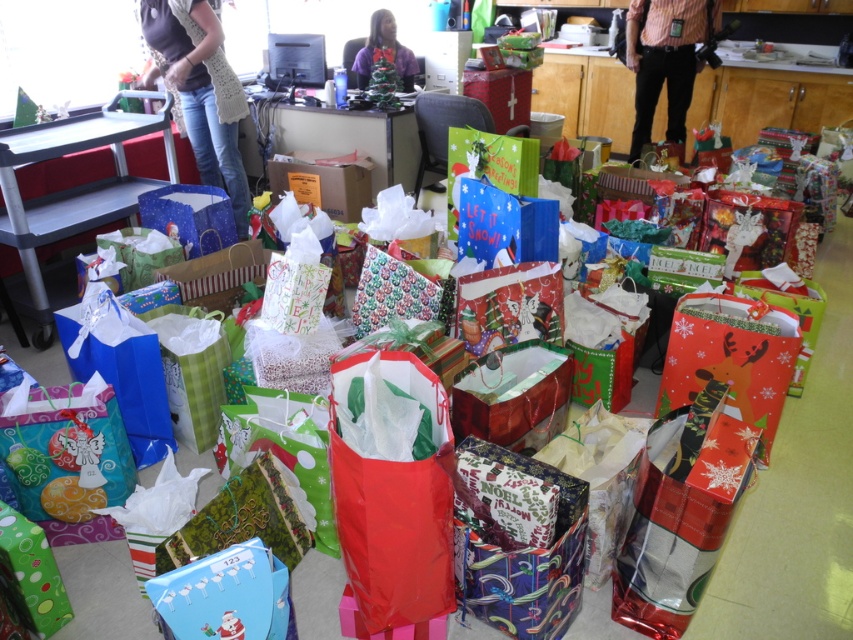
From the picture: You are at a Christmas party and see the denim jeans at left and the striped shirt at upper right. Which one is closer to you?

The denim jeans at left is closer to you because it is in front of the striped shirt at upper right.

You are helping to organize a holiday gift drive and need to place a new gift bag. You see the denim jeans at left and the cardboard box at center. Which object should you place the gift bag on to ensure it is visible to attendees?

You should place the gift bag on the denim jeans at left because it is above the cardboard box at center, making it more visible to attendees.

You are standing in the room with all the gift bags and want to reach both points. Which point, point [207,180] or point [360,205], is closer to you?

Point [207,180] is closer to you than point [360,205].